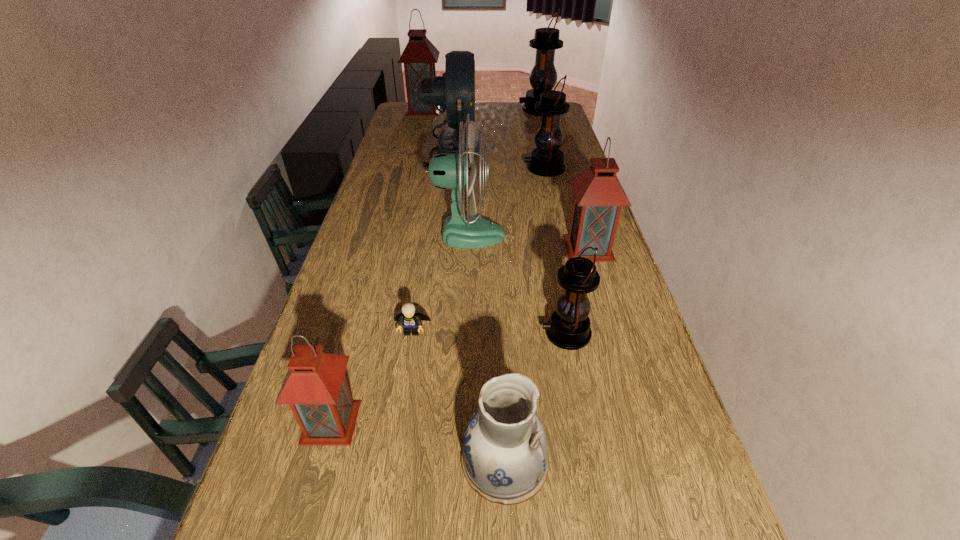
This screenshot has height=540, width=960. In order to click on blank region between the second farthest pink lantern and the farthest pink lantern in this screenshot , I will do `click(506, 178)`.

The width and height of the screenshot is (960, 540). I want to click on empty space that is in between the farther fan and the second nearest black lantern, so click(497, 158).

Identify the location of free space between the biggest pink lantern and the shortest object. Image resolution: width=960 pixels, height=540 pixels. (418, 220).

This screenshot has width=960, height=540. I want to click on free space between the biggest pink lantern and the blue pottery, so click(464, 285).

I want to click on free space between the nearest pink lantern and the blue fan, so click(x=391, y=285).

Where is `empty space that is in between the second nearest black lantern and the smallest pink lantern`? empty space that is in between the second nearest black lantern and the smallest pink lantern is located at coordinates (438, 295).

Identify the location of free spot between the second shortest object and the farther fan. Image resolution: width=960 pixels, height=540 pixels. (477, 305).

Select which object is the ninth closest to the nearest black lantern. Please provide its 2D coordinates. Your answer should be formatted as a tuple, i.e. [(x, y)], where the tuple contains the x and y coordinates of a point satisfying the conditions above.

[(419, 57)]

Point out which object is positioned as the eighth nearest to the biggest black lantern. Please provide its 2D coordinates. Your answer should be formatted as a tuple, i.e. [(x, y)], where the tuple contains the x and y coordinates of a point satisfying the conditions above.

[(504, 458)]

Identify which lantern is located as the nearest to the biggest black lantern. Please provide its 2D coordinates. Your answer should be formatted as a tuple, i.e. [(x, y)], where the tuple contains the x and y coordinates of a point satisfying the conditions above.

[(419, 57)]